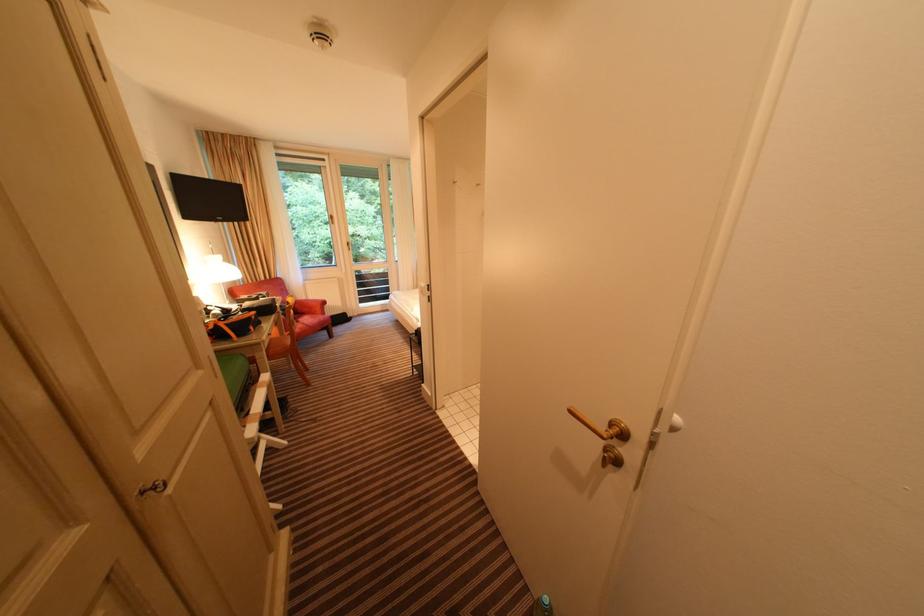
Identify the location of gold door handle. (602, 427).